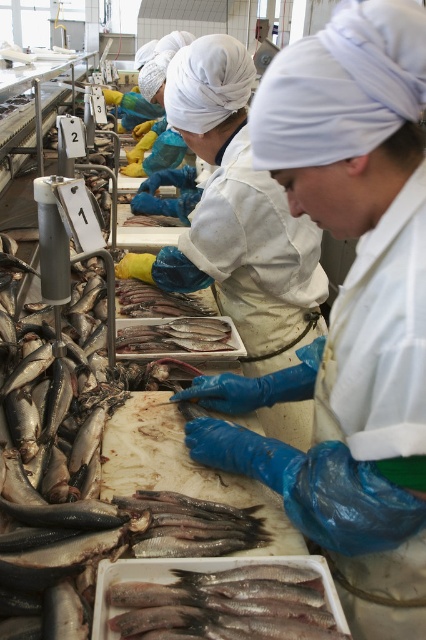
You are a quality inspector standing at the processing table. You need to check the fish at point (146,596) and point (196,337). Which fish is closer to you?

The fish at point (146,596) is closer to you than the fish at point (196,337).

In the fish processing facility, there is a point at coordinates (236,216). Which object from the list below is located at this point? Choose from the objects listed below. Objects available are blue disposable gloves at center, white trays at lower left, and silvery fish on table at upper right.

The point at coordinates (236,216) is located on the blue disposable gloves at center.